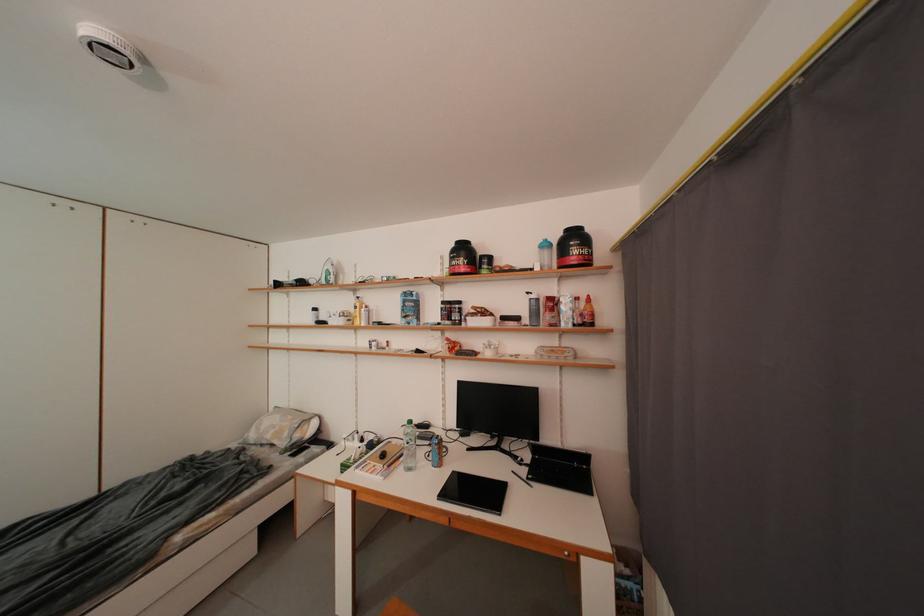
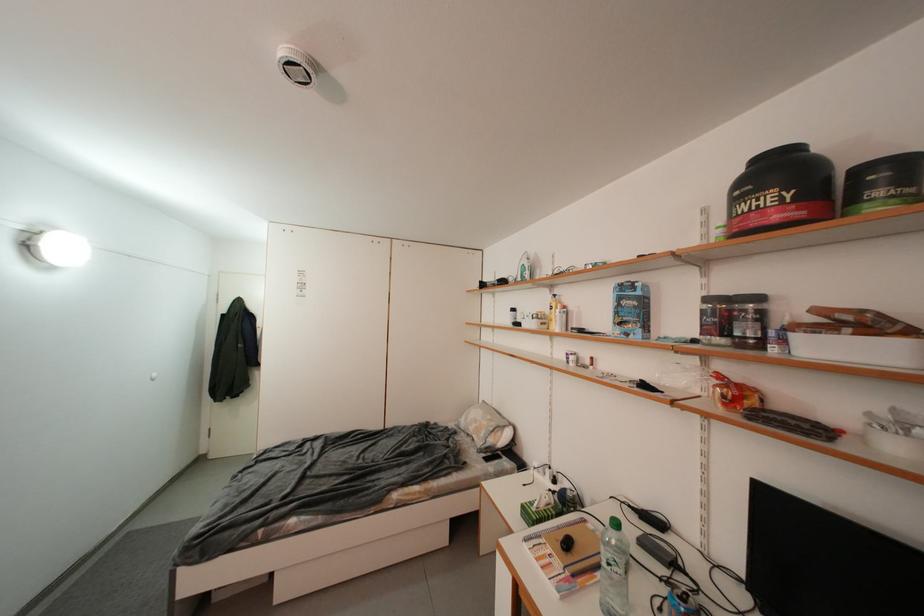
In the second image, find the point that corresponds to [492,270] in the first image.

(886, 196)